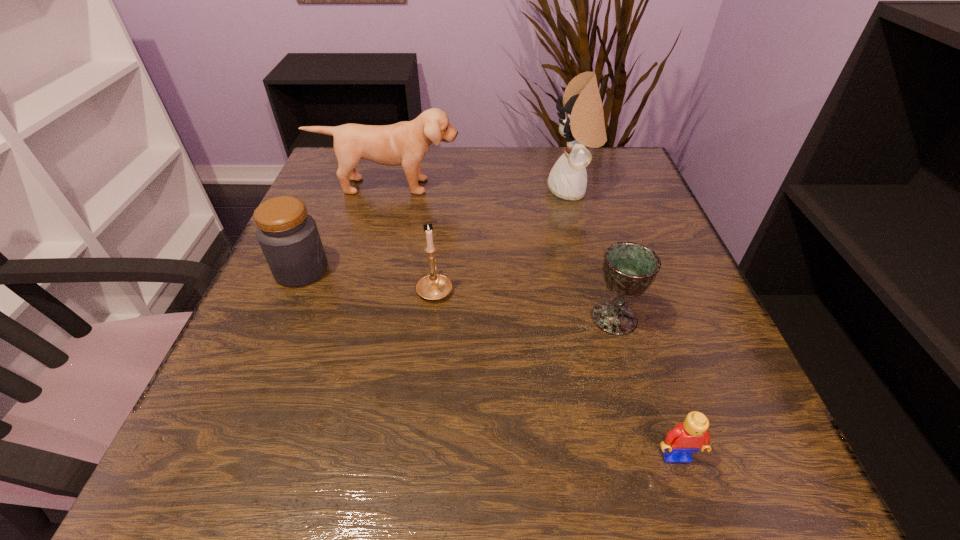
The image size is (960, 540). In order to click on blank area in the image that satisfies the following two spatial constraints: 1. on the surface of the jar near the warning symbol; 2. on the left side of the chalice in this screenshot , I will do `click(281, 318)`.

The image size is (960, 540). What are the coordinates of `free spot that satisfies the following two spatial constraints: 1. at the front face of the chalice; 2. on the right side of the tallest object` in the screenshot? It's located at [x=606, y=318].